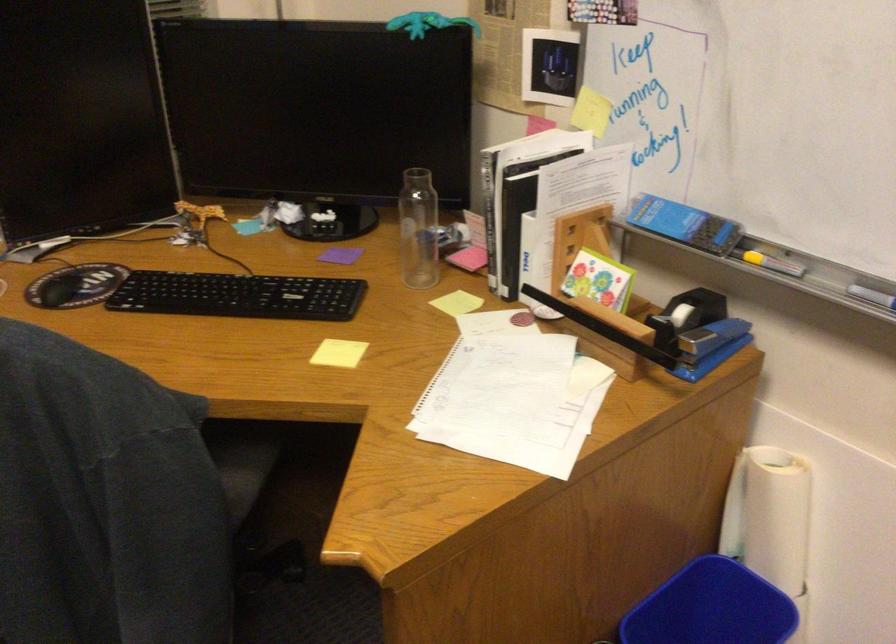
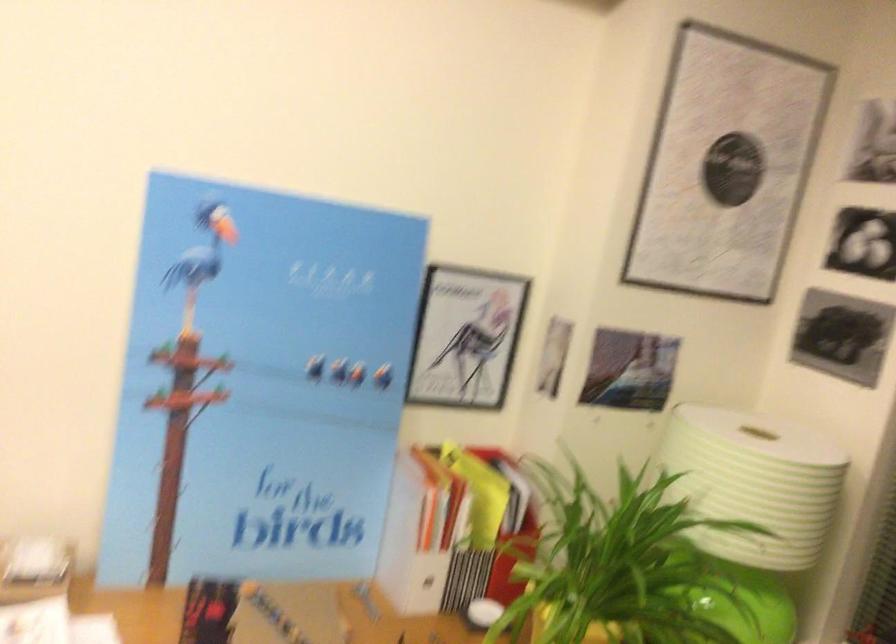
Question: The first image is from the beginning of the video and the second image is from the end. How did the camera likely rotate when shooting the video?

Choices:
 (A) Left
 (B) Right
 (C) Up
 (D) Down

Answer: (A)